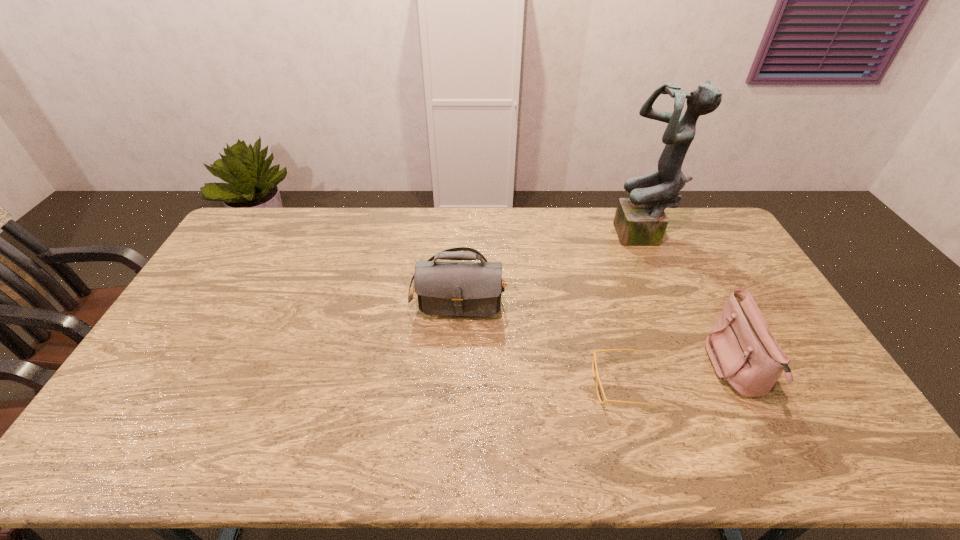
Find the location of a particular element. This screenshot has height=540, width=960. the tallest object is located at coordinates (640, 220).

At what (x,y) coordinates should I click in order to perform the action: click on the second tallest object. Please return your answer as a coordinate pair (x, y). The width and height of the screenshot is (960, 540). Looking at the image, I should click on (443, 288).

You are a GUI agent. You are given a task and a screenshot of the screen. Output one action in this format:
    pyautogui.click(x=<x>, y=<y>)
    Task: Click on the leftmost object
    This screenshot has height=540, width=960.
    Given the screenshot: What is the action you would take?
    pyautogui.click(x=443, y=288)

You are a GUI agent. You are given a task and a screenshot of the screen. Output one action in this format:
    pyautogui.click(x=<x>, y=<y>)
    Task: Click on the shorter shoulder bag
    
    Given the screenshot: What is the action you would take?
    pyautogui.click(x=744, y=353)

Locate an element on the screen. Image resolution: width=960 pixels, height=540 pixels. the nearer shoulder bag is located at coordinates (744, 353).

You are a GUI agent. You are given a task and a screenshot of the screen. Output one action in this format:
    pyautogui.click(x=<x>, y=<y>)
    Task: Click on the second object from left to right
    Image resolution: width=960 pixels, height=540 pixels.
    Given the screenshot: What is the action you would take?
    pyautogui.click(x=594, y=355)

Identify the location of spectacles. Image resolution: width=960 pixels, height=540 pixels. (594, 355).

Locate an element on the screen. This screenshot has height=540, width=960. free space located 0.310m on the face of the sculpture is located at coordinates (533, 238).

Where is `vacant space located on the face of the sculpture`? vacant space located on the face of the sculpture is located at coordinates (546, 238).

Where is `vacant space located 0.290m on the face of the sculpture`? Image resolution: width=960 pixels, height=540 pixels. vacant space located 0.290m on the face of the sculpture is located at coordinates (539, 238).